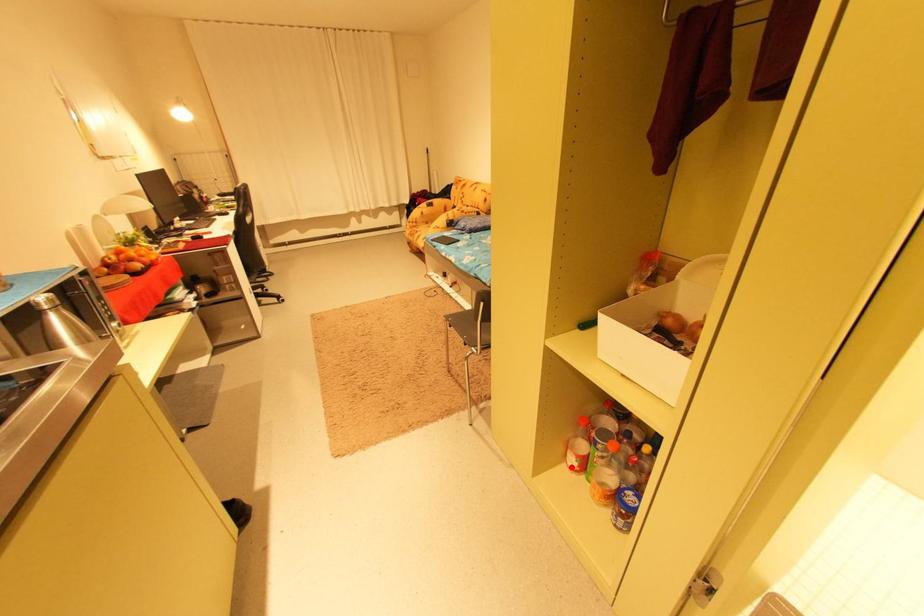
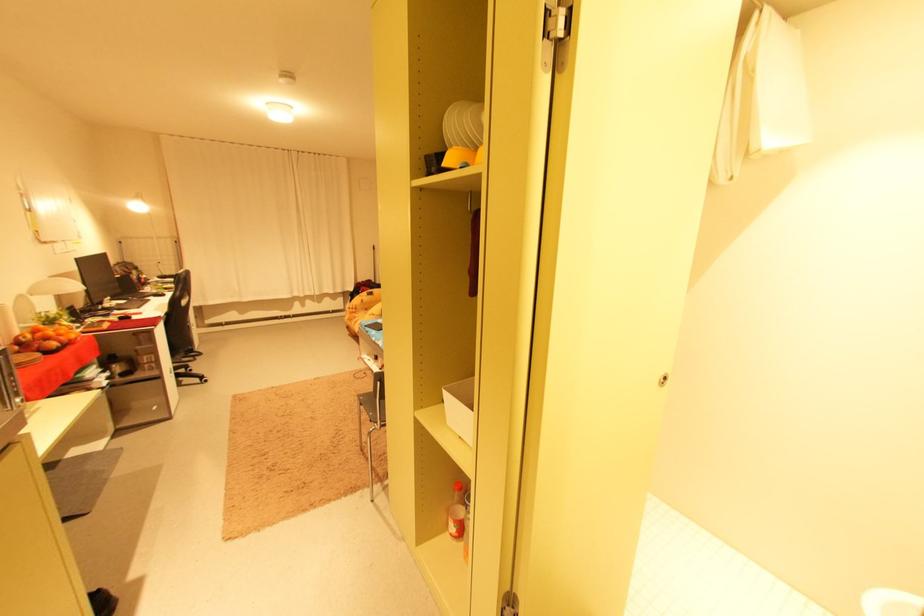
Find the pixel in the second image that matches the highlighted location in the first image.

(455, 536)